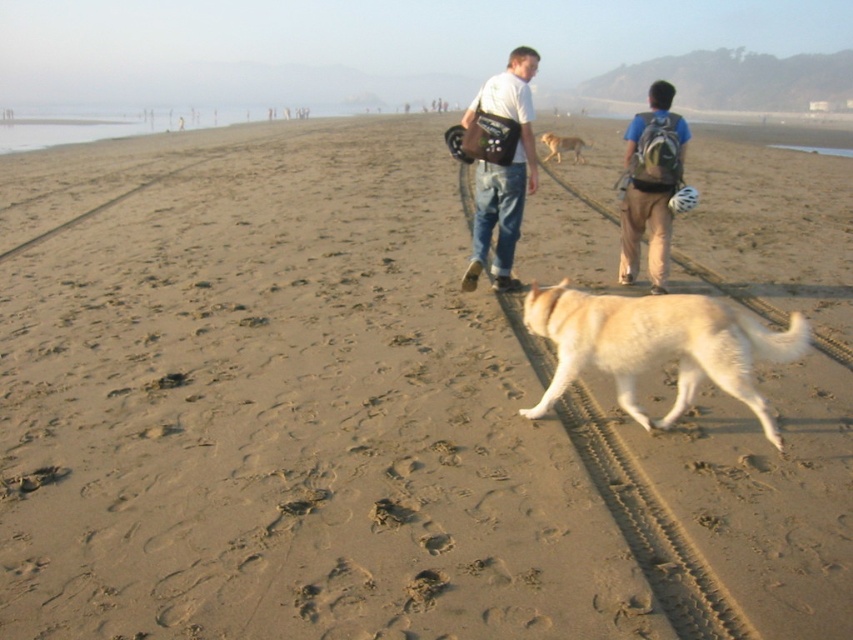
Is matte brown bag at center bigger than golden fur dog at center?

Yes.

Between matte brown bag at center and golden fur dog at center, which one is positioned lower?

matte brown bag at center

Where is `matte brown bag at center`? matte brown bag at center is located at coordinates (502, 170).

Does point (740, 381) come farther from viewer compared to point (648, 122)?

No, it is not.

Which of these two, white fluffy dog at center or matte brown backpack at right, stands taller?

With more height is matte brown backpack at right.

Where is `white fluffy dog at center`? The width and height of the screenshot is (853, 640). white fluffy dog at center is located at coordinates (657, 346).

The width and height of the screenshot is (853, 640). Find the location of `white fluffy dog at center`. white fluffy dog at center is located at coordinates (657, 346).

Does matte brown backpack at right appear over golden fur dog at center?

No, matte brown backpack at right is not above golden fur dog at center.

From the picture: Does matte brown backpack at right have a lesser width compared to golden fur dog at center?

Indeed, matte brown backpack at right has a lesser width compared to golden fur dog at center.

This screenshot has width=853, height=640. Describe the element at coordinates (650, 186) in the screenshot. I see `matte brown backpack at right` at that location.

This screenshot has width=853, height=640. I want to click on matte brown backpack at right, so click(x=650, y=186).